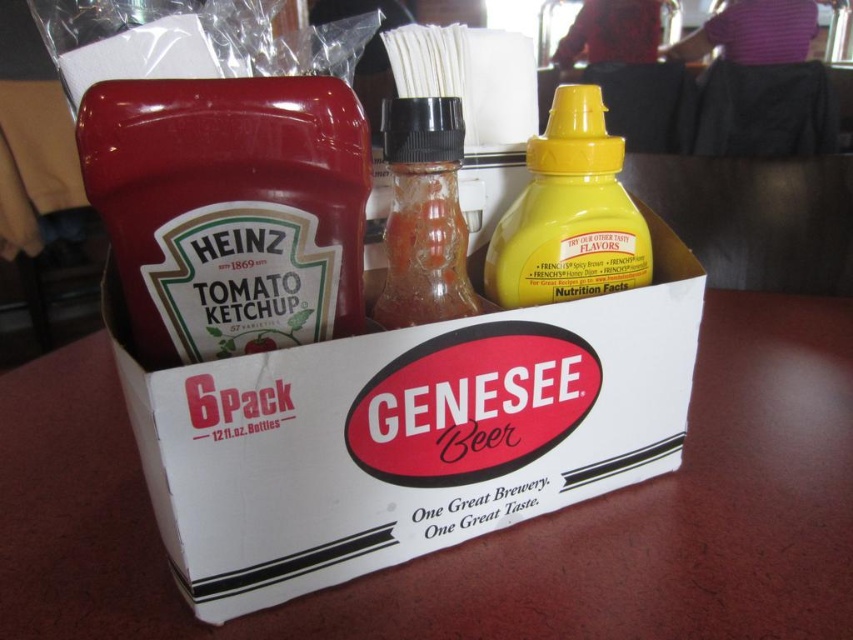
In the scene shown: You are organizing a picnic basket and have both the white cardboard box at center and the yellow matte mustard at center. Which item will you place first if you want to pack larger items first?

A: The white cardboard box at center has a larger size compared to the yellow matte mustard at center, so you should place the white cardboard box at center first.

You are setting up a picnic basket and have a limited space between the matte glass bottle at center and the yellow matte mustard at center. The space between them is exactly 10.30 inches. If your basket can only accommodate items spaced 10 inches apart, will these two items fit together in the basket?

The matte glass bottle at center and the yellow matte mustard at center are exactly 10.30 inches apart, which exceeds the basket requirement of 10 inches. Therefore, they cannot fit together in the basket.

You are organizing a picnic basket and need to access the yellow matte mustard at center. The matte glass bottle at center is blocking it. How can you retrieve the mustard?

Move the matte glass bottle at center out of the way to access the yellow matte mustard at center, since the matte glass bottle at center is in front of the yellow matte mustard at center.